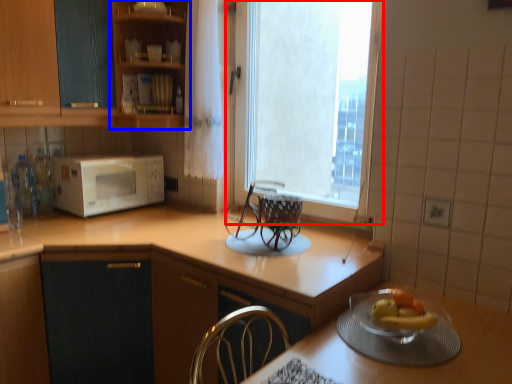
Question: Among these objects, which one is nearest to the camera, window (highlighted by a red box) or cabinetry (highlighted by a blue box)?

Choices:
 (A) window
 (B) cabinetry

Answer: (A)